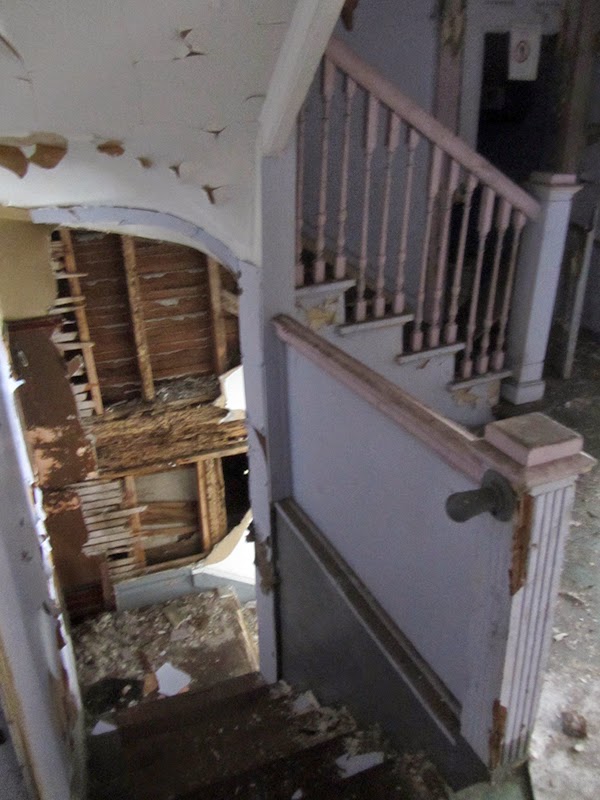
Where is `stair`? The image size is (600, 800). stair is located at coordinates (216, 765).